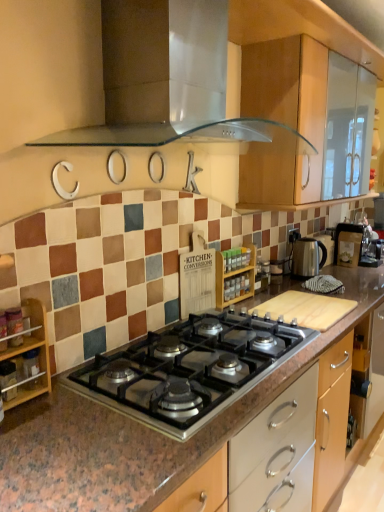
Question: Is transparent glass range hood at upper center taller or shorter than wooden shelf at left?

Choices:
 (A) tall
 (B) short

Answer: (A)

Question: From the image's perspective, is transparent glass range hood at upper center positioned above or below wooden shelf at left?

Choices:
 (A) below
 (B) above

Answer: (B)

Question: Which object is the farthest from the metallic silver kettle at right, the 2th appliance viewed from the left?

Choices:
 (A) silver metallic kettle at right
 (B) wooden spice rack at center, positioned as the 3th appliance in right-to-left order
 (C) black stainless steel gas stove at center
 (D) transparent glass range hood at upper center
 (E) metallic silver coffee maker at right, acting as the third appliance starting from the left

Answer: (C)

Question: Considering the real-world distances, which object is closest to the metallic silver kettle at right, the 1th appliance positioned from the back?

Choices:
 (A) wooden spice rack at center, positioned as the 3th appliance in right-to-left order
 (B) metallic silver coffee maker at right, the 2th appliance when ordered from back to front
 (C) transparent glass range hood at upper center
 (D) silver metallic kettle at right
 (E) wooden shelf at left

Answer: (D)